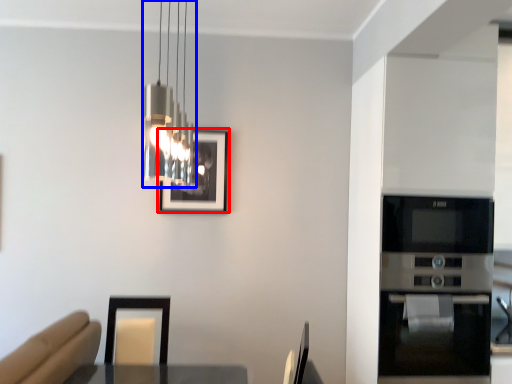
Question: Which object appears closest to the camera in this image, picture frame (highlighted by a red box) or lamp (highlighted by a blue box)?

Choices:
 (A) picture frame
 (B) lamp

Answer: (B)